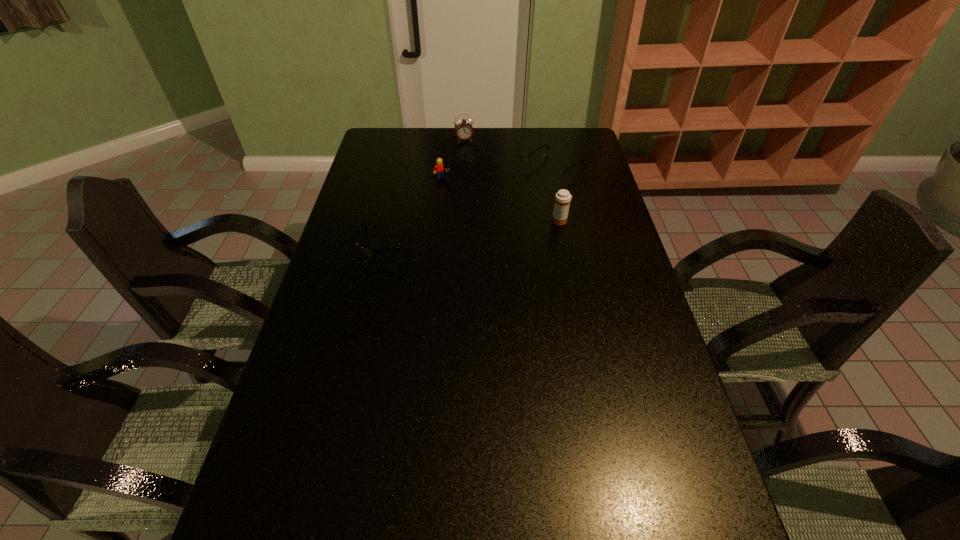
The height and width of the screenshot is (540, 960). I want to click on the left spectacles, so click(x=389, y=251).

Where is `the nearer spectacles`? This screenshot has height=540, width=960. the nearer spectacles is located at coordinates (389, 251).

Where is `medicine`? This screenshot has height=540, width=960. medicine is located at coordinates (562, 198).

Locate an element on the screen. the right spectacles is located at coordinates (551, 174).

Where is `the second object from left to right`? This screenshot has width=960, height=540. the second object from left to right is located at coordinates (439, 169).

In order to click on the farthest object in this screenshot , I will do `click(463, 128)`.

This screenshot has width=960, height=540. Find the location of `alarm clock`. alarm clock is located at coordinates (463, 128).

Locate an element on the screen. free space located on the front-facing side of the leftmost object is located at coordinates (353, 374).

Where is `vacant space located 0.110m on the front of the medicine`? This screenshot has height=540, width=960. vacant space located 0.110m on the front of the medicine is located at coordinates (565, 248).

The image size is (960, 540). I want to click on vacant area located at the hinge ends of the farther spectacles, so click(x=517, y=195).